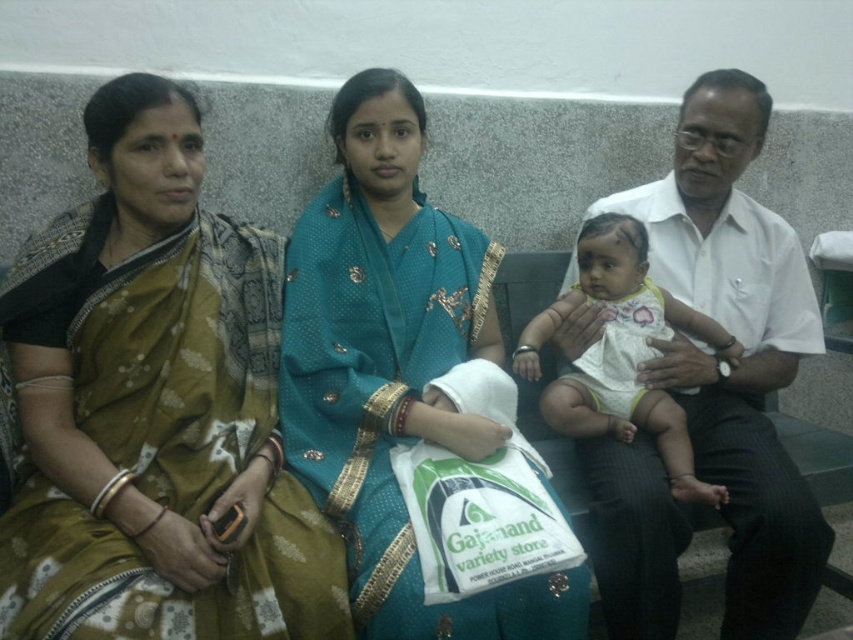
Question: Does brown silk saree at left appear on the left side of white cotton baby at center?

Choices:
 (A) no
 (B) yes

Answer: (B)

Question: Considering the real-world distances, which object is closest to the white smooth shirt at right?

Choices:
 (A) brown silk saree at left
 (B) white cotton baby at center
 (C) teal silk saree at center

Answer: (B)

Question: Which of the following is the closest to the observer?

Choices:
 (A) brown silk saree at left
 (B) white smooth shirt at right

Answer: (A)

Question: Does white smooth shirt at right have a greater width compared to white cotton baby at center?

Choices:
 (A) no
 (B) yes

Answer: (B)

Question: Which object appears farthest from the camera in this image?

Choices:
 (A) white cotton baby at center
 (B) teal silk saree at center
 (C) white smooth shirt at right
 (D) brown silk saree at left

Answer: (A)

Question: Is brown silk saree at left closer to the viewer compared to white cotton baby at center?

Choices:
 (A) yes
 (B) no

Answer: (A)